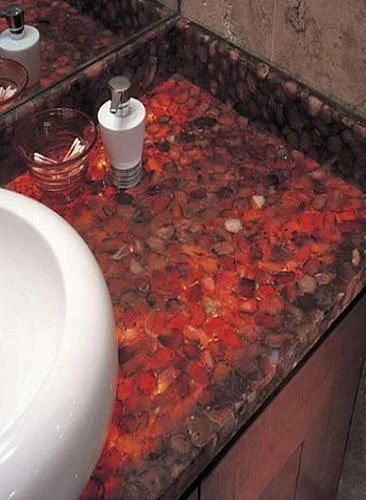
Identify the location of corner. (181, 12).